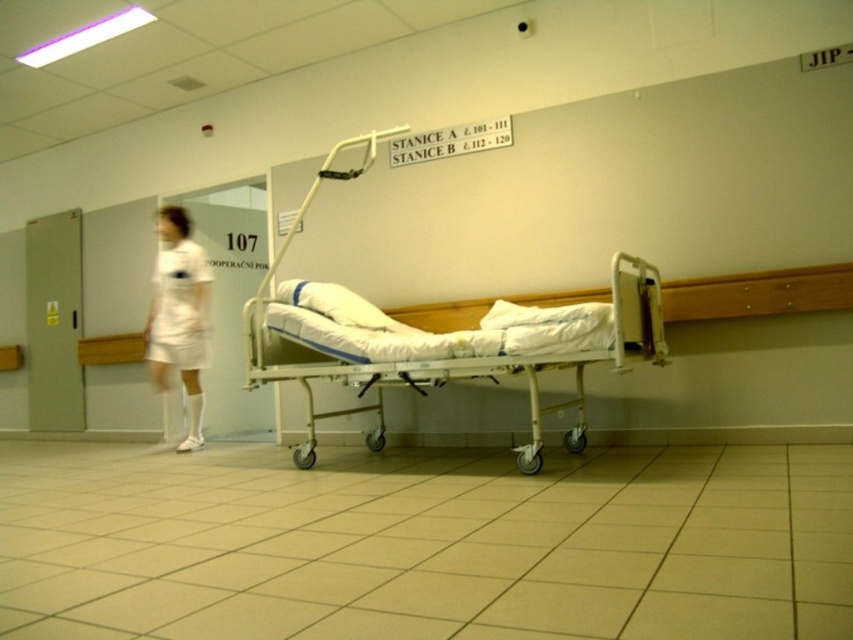
You are a GUI agent. You are given a task and a screenshot of the screen. Output one action in this format:
    pyautogui.click(x=<x>, y=<y>)
    Task: Click on the white plastic hospital bed at center
    The height and width of the screenshot is (640, 853).
    Given the screenshot: What is the action you would take?
    pyautogui.click(x=448, y=346)

Does white plastic hospital bed at center appear on the left side of white matte uniform at left?

No, white plastic hospital bed at center is not to the left of white matte uniform at left.

Which is behind, point (408, 385) or point (201, 301)?

Positioned behind is point (201, 301).

The height and width of the screenshot is (640, 853). What are the coordinates of `white plastic hospital bed at center` in the screenshot? It's located at (448, 346).